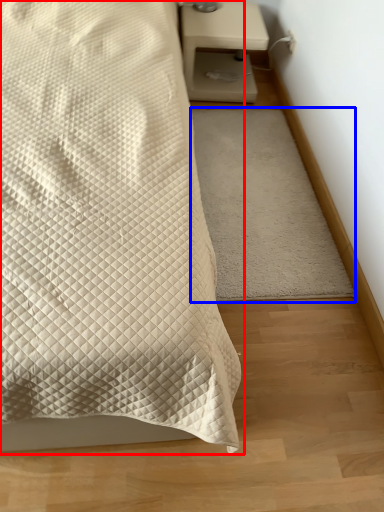
Question: Which of the following is the closest to the observer, bed (highlighted by a red box) or mat (highlighted by a blue box)?

Choices:
 (A) bed
 (B) mat

Answer: (A)